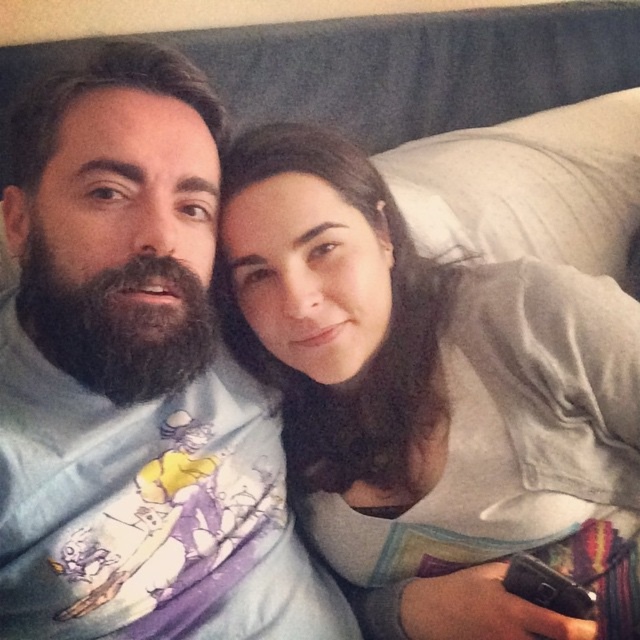
You are standing in the room and want to place a small decorative item on the bed. You have two options for placement coordinates based on the image coordinates provided. The first option is at point [188,580] and the second is at point [634,100]. Which point is closer to the camera and thus more visible to someone looking directly at the bed?

Point [188,580] is in front of point [634,100], so it is closer to the camera and more visible to someone looking directly at the bed.

You are designing a layout for a photo album and need to ensure that the smooth gray shirt at center and the white soft pillow at upper right are placed in a way that maintains their relative height as seen in the original image. Which object should be positioned higher in the album layout?

The smooth gray shirt at center should be positioned higher in the album layout since it has a greater height compared to the white soft pillow at upper right.

You are a photographer setting up a shoot in this room. You need to ensure that the light blue cotton shirt at center and the white soft pillow at upper right are both visible in the frame. Given their sizes, which object might require you to adjust your camera angle to include it properly?

The white soft pillow at upper right occupies more space than the light blue cotton shirt at center, so it might require adjusting the camera angle to ensure it fits within the frame.